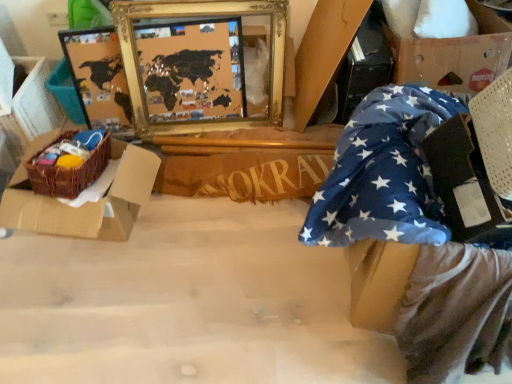
Find the location of a particular element. This screenshot has width=512, height=384. vacant area that is situated to the right of brown woven basket at left is located at coordinates (213, 246).